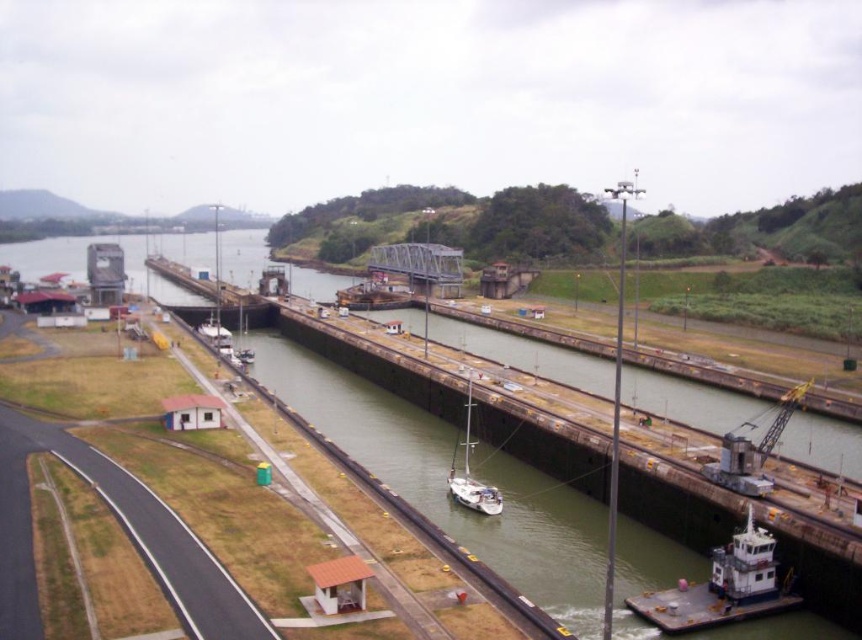
In the scene shown: Which is below, white matte tugboat at lower right or white matte sailboat at center?

Positioned lower is white matte tugboat at lower right.

Between point (721, 592) and point (470, 404), which one is positioned behind?

The point (470, 404) is more distant.

Find the location of `white matte tugboat at lower right`. white matte tugboat at lower right is located at coordinates (723, 586).

What are the coordinates of `white matte tugboat at lower right` in the screenshot? It's located at (723, 586).